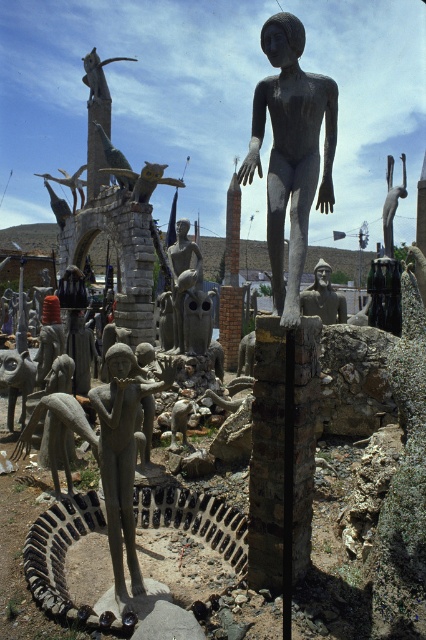
From the picture: You are an art critic analyzing the spatial arrangement of the sculptures in the image. Which object is located at the coordinates point (290, 152)?

The point (290, 152) corresponds to the bronze statue at center.